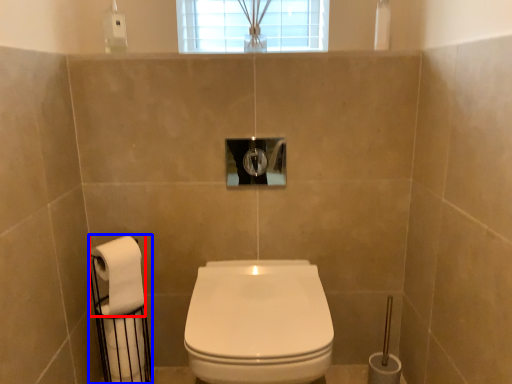
Question: Which object is closer to the camera taking this photo, toilet paper (highlighted by a red box) or toilet paper (highlighted by a blue box)?

Choices:
 (A) toilet paper
 (B) toilet paper

Answer: (A)